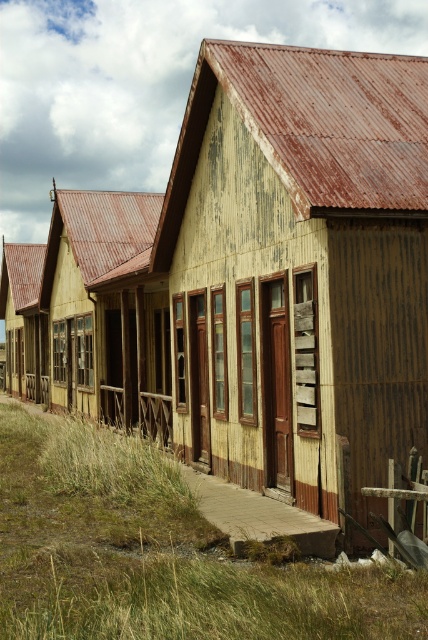
You are standing in front of the wooden planks hut at center and want to walk to the green grass at lower left. Is the path clear? Explain why.

The green grass at lower left is below the wooden planks hut at center, so the path is clear because the grass is located at a lower position relative to the hut.

You are standing on the green grass at lower left and want to reach the weathered wood hut at center. Which direction should you move to get there?

You should move upward to reach the weathered wood hut at center because it is above the green grass at lower left.